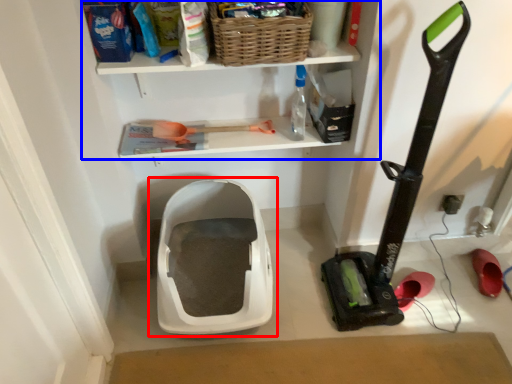
Question: Which object is further to the camera taking this photo, toilet (highlighted by a red box) or shelf (highlighted by a blue box)?

Choices:
 (A) toilet
 (B) shelf

Answer: (A)